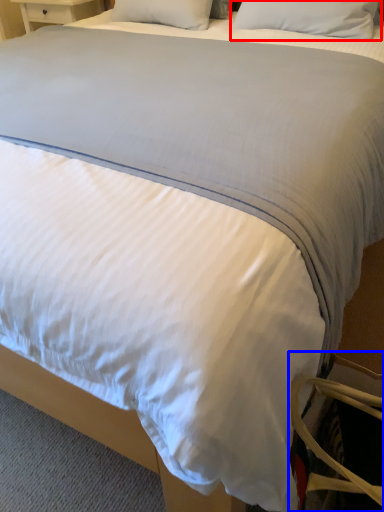
Question: Which point is further to the camera, pillow (highlighted by a red box) or swivel chair (highlighted by a blue box)?

Choices:
 (A) pillow
 (B) swivel chair

Answer: (A)